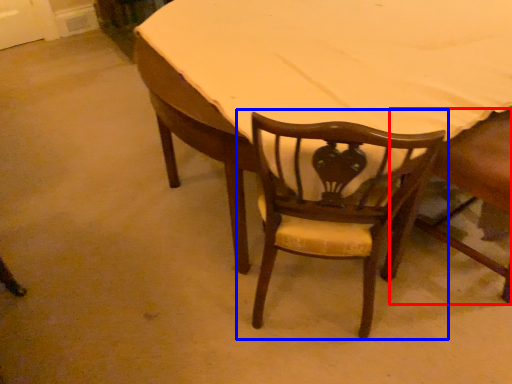
Question: Which of the following is the closest to the observer, chair (highlighted by a red box) or chair (highlighted by a blue box)?

Choices:
 (A) chair
 (B) chair

Answer: (B)